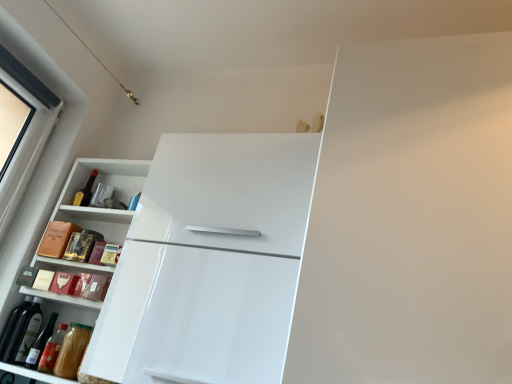
Question: Are green glass wine bottle at lower left and white glossy cabinet at left making contact?

Choices:
 (A) no
 (B) yes

Answer: (A)

Question: Is green glass wine bottle at lower left bigger than white glossy cabinet at left?

Choices:
 (A) yes
 (B) no

Answer: (B)

Question: From a real-world perspective, is green glass wine bottle at lower left located beneath white glossy cabinet at left?

Choices:
 (A) no
 (B) yes

Answer: (B)

Question: Is green glass wine bottle at lower left thinner than white glossy cabinet at left?

Choices:
 (A) yes
 (B) no

Answer: (A)

Question: From the image's perspective, is green glass wine bottle at lower left beneath white glossy cabinet at left?

Choices:
 (A) no
 (B) yes

Answer: (B)

Question: Is matte glass bottle at upper left taller or shorter than white glossy refrigerator at upper center?

Choices:
 (A) tall
 (B) short

Answer: (B)

Question: Looking at the image, does matte glass bottle at upper left seem bigger or smaller compared to white glossy refrigerator at upper center?

Choices:
 (A) small
 (B) big

Answer: (A)

Question: Relative to white glossy refrigerator at upper center, is matte glass bottle at upper left in front or behind?

Choices:
 (A) front
 (B) behind

Answer: (B)

Question: Looking at their shapes, would you say matte glass bottle at upper left is wider or thinner than white glossy refrigerator at upper center?

Choices:
 (A) wide
 (B) thin

Answer: (B)

Question: Is white glossy cabinet at left situated inside matte glass bottle at upper left or outside?

Choices:
 (A) outside
 (B) inside

Answer: (A)

Question: Is white glossy cabinet at left wider or thinner than matte glass bottle at upper left?

Choices:
 (A) thin
 (B) wide

Answer: (B)

Question: Is white glossy cabinet at left bigger or smaller than matte glass bottle at upper left?

Choices:
 (A) big
 (B) small

Answer: (A)

Question: From a real-world perspective, is white glossy cabinet at left physically located above or below matte glass bottle at upper left?

Choices:
 (A) below
 (B) above

Answer: (A)

Question: Considering their positions, is matte glass bottle at upper left located in front of or behind white glossy cabinet at left?

Choices:
 (A) behind
 (B) front

Answer: (A)

Question: Is matte glass bottle at upper left situated inside white glossy cabinet at left or outside?

Choices:
 (A) inside
 (B) outside

Answer: (A)